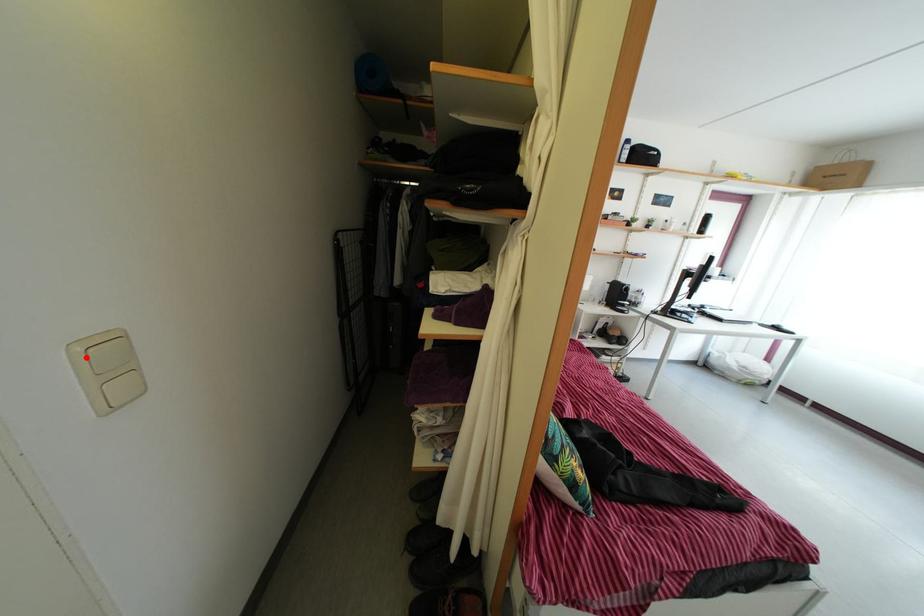
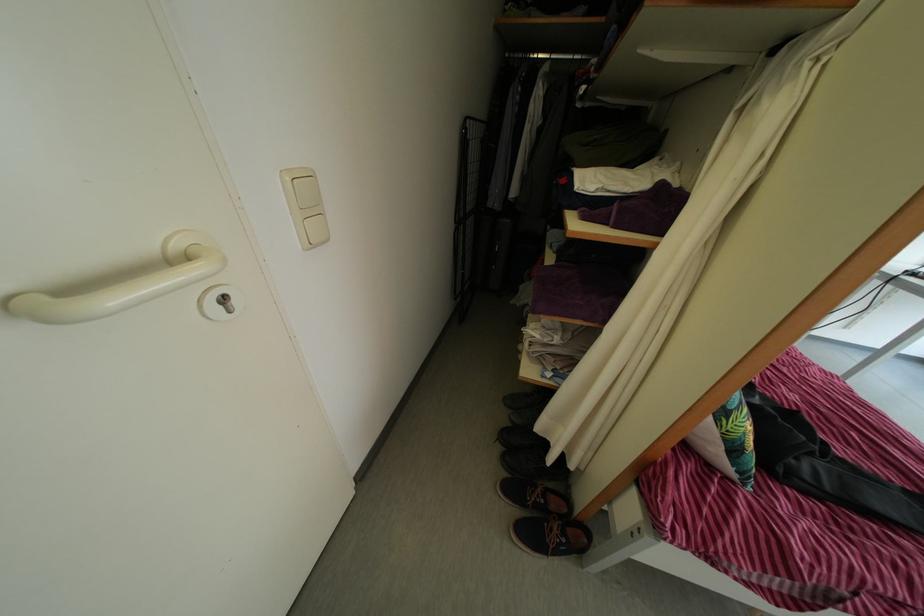
Question: I am providing you with two images of the same scene from different viewpoints. A red point is marked on the first image. At the location where the point appears in image 1, is it still visible in image 2?

Choices:
 (A) Yes
 (B) No

Answer: (A)